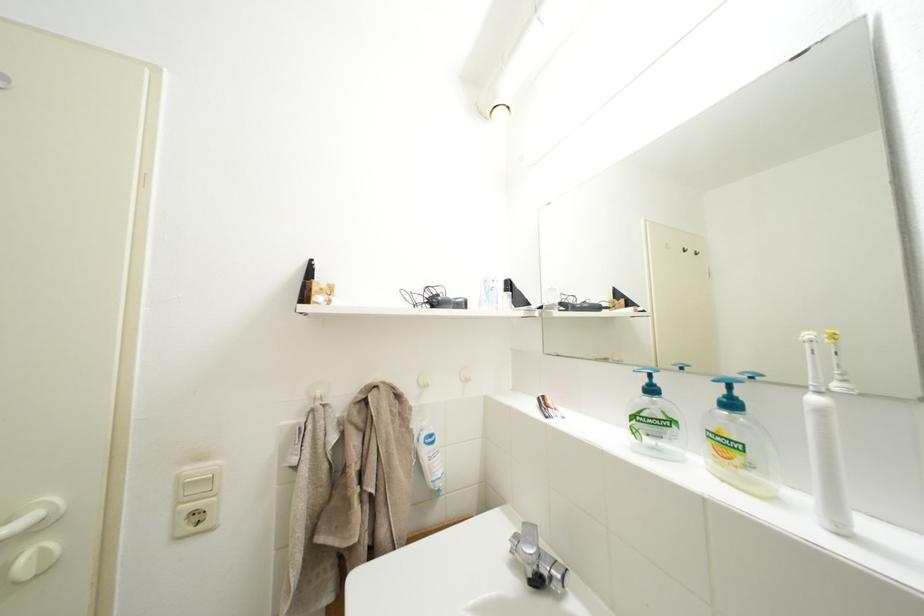
The image size is (924, 616). Identify the location of white light switch. (198, 485).